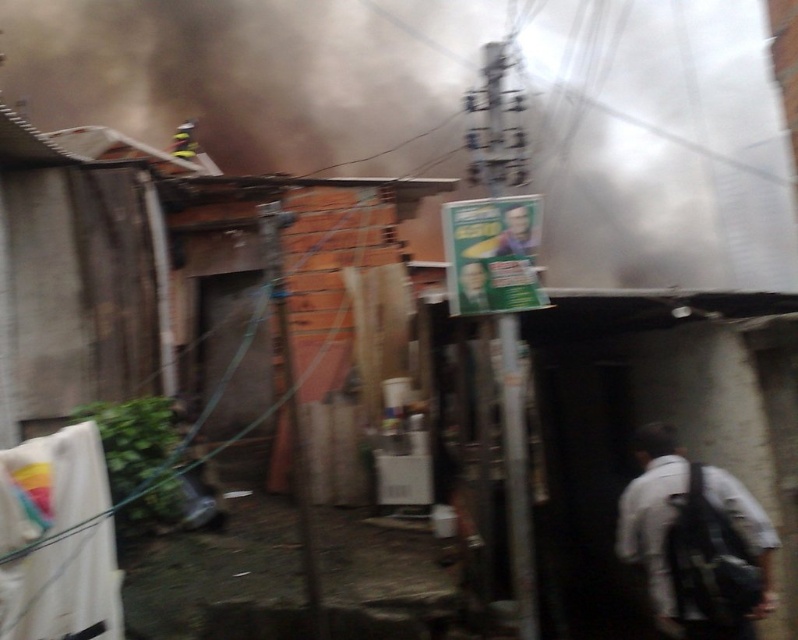
You are a firefighter assessing the scene. You notice the black smoke at upper center and the white fabric shirt at right. Which object appears wider from your vantage point?

The black smoke at upper center appears wider than the white fabric shirt at right because its width surpasses that of the shirt.

You are a drone operator trying to navigate through the alley. You notice two points in the scene at coordinates point (386,150) and point (30,499). Which point is closer to your drone if it is positioned at the camera location?

Point (386,150) is closer to the camera than point (30,499) because it is further to the camera than the other point.

You are a photographer trying to capture both the white fabric shirt at right and the white fabric at left in the same frame. Based on their positions, which one will appear larger in your photo?

The white fabric shirt at right will appear larger in the photo because it is closer to the viewer than the white fabric at left.